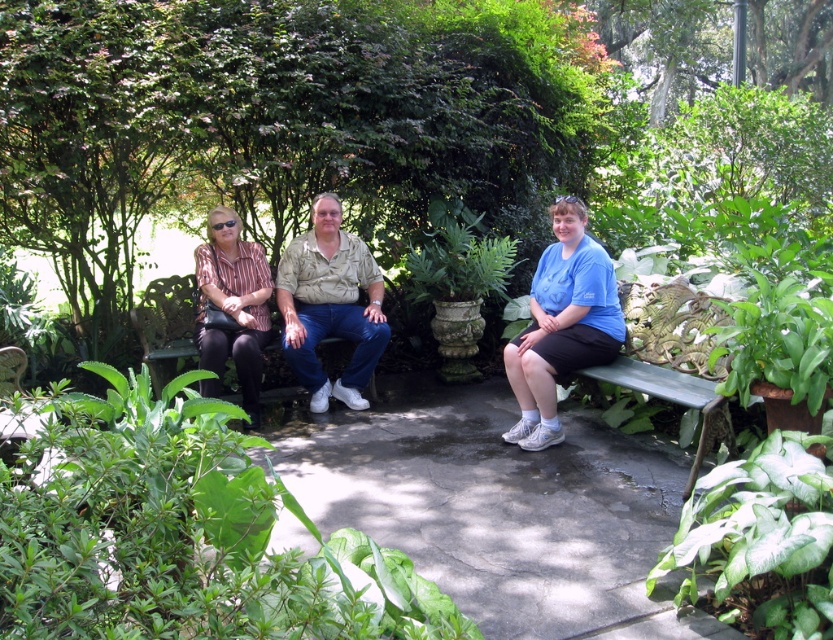
You are a photographer trying to capture a portrait of the two people sitting on the bench. Since you want to focus on the blue cotton shirt at center, which is closer to you, should you position yourself in front of or behind the striped fabric shirt at left to avoid blocking the view?

You should position yourself in front of the striped fabric shirt at left to avoid blocking the view of the blue cotton shirt at center since the blue cotton shirt at center is closer to the viewer than the striped fabric shirt at left.

You are standing in the garden and want to place a small potted plant between the two points, point (268, 504) and point (262, 346). Which point should the plant be closer to in order to be in front of both points?

The plant should be placed closer to point (268, 504) because it is closer to the camera than point (262, 346).